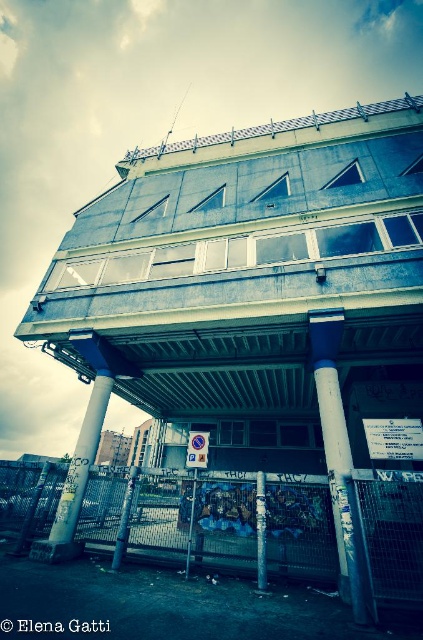
Question: Which point is closer to the camera?

Choices:
 (A) white glossy pillar at center
 (B) rusty metal fence at lower center

Answer: (B)

Question: Which point is closer to the camera?

Choices:
 (A) gray concrete pillar at lower left
 (B) blue painted metal pole at center
 (C) metallic gray pillar at center

Answer: (B)

Question: Which object appears farthest from the camera in this image?

Choices:
 (A) metallic gray pillar at center
 (B) rusty metal fence at lower center

Answer: (A)

Question: Can you confirm if rusty metal fence at lower center is smaller than metallic gray pillar at center?

Choices:
 (A) no
 (B) yes

Answer: (A)

Question: Does rusty metal fence at lower center appear over blue painted metal pole at center?

Choices:
 (A) yes
 (B) no

Answer: (B)

Question: Is rusty metal fence at lower center thinner than white glossy pillar at center?

Choices:
 (A) yes
 (B) no

Answer: (B)